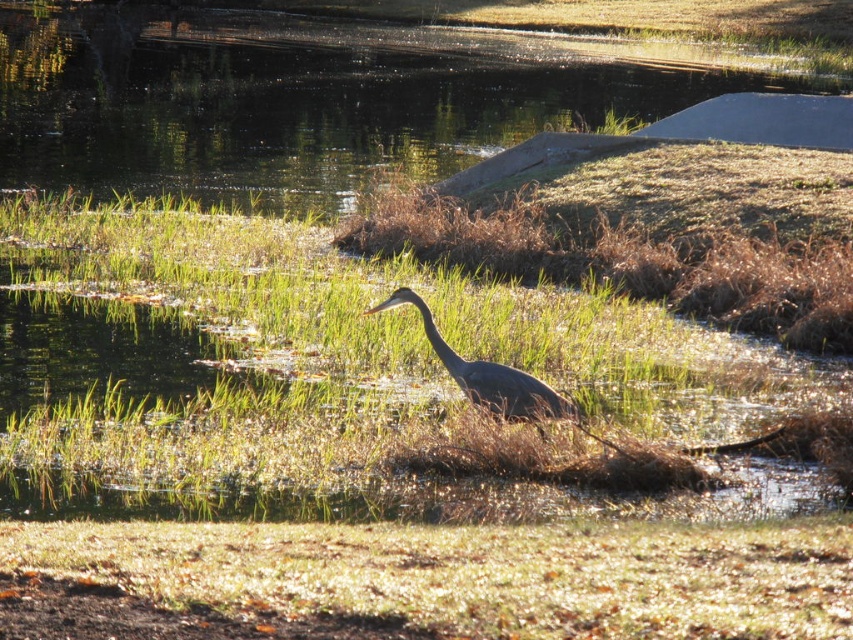
Question: Where is green grass at center located in relation to gray matte heron at center in the image?

Choices:
 (A) below
 (B) above

Answer: (B)

Question: Which point is farther from the camera taking this photo?

Choices:
 (A) (80, 240)
 (B) (260, 61)
 (C) (534, 401)

Answer: (B)

Question: Is green grass at center further to camera compared to clear water at center?

Choices:
 (A) yes
 (B) no

Answer: (B)

Question: Which point is closer to the camera taking this photo?

Choices:
 (A) (572, 406)
 (B) (62, 275)
 (C) (712, 60)

Answer: (A)

Question: Which point is farther to the camera?

Choices:
 (A) green grass at center
 (B) clear water at center
 (C) gray matte heron at center

Answer: (B)

Question: Does green grass at center lie behind clear water at center?

Choices:
 (A) yes
 (B) no

Answer: (B)